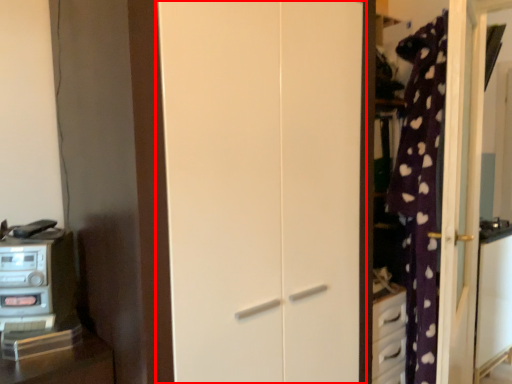
Question: From the image, what is the correct spatial relationship of door (annotated by the red box) in relation to appliance?

Choices:
 (A) left
 (B) right

Answer: (B)